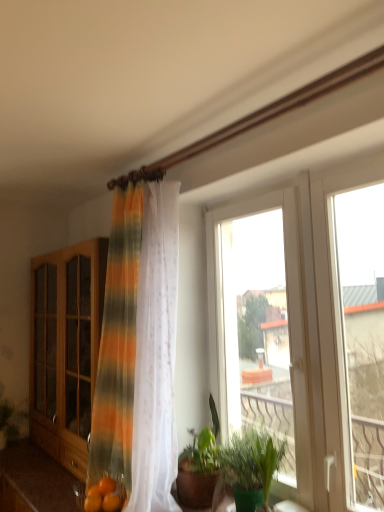
This screenshot has width=384, height=512. In order to click on vacant space situated above transparent glass window at center, the third window when ordered from right to left (from a real-world perspective) in this screenshot , I will do pyautogui.click(x=241, y=196).